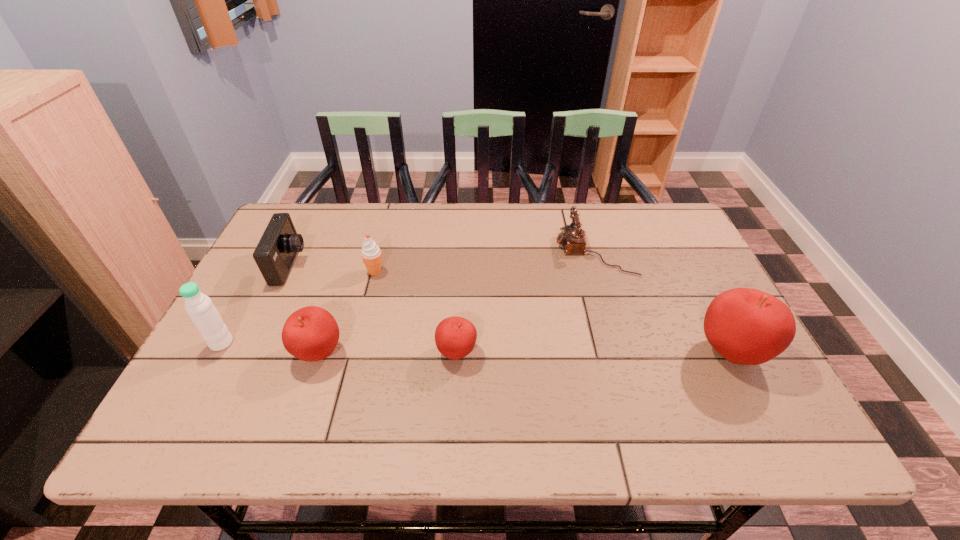
Locate an element on the screen. vacant position located 0.300m on the left of the shortest apple is located at coordinates (307, 353).

Where is `vacant space located on the left of the rightmost object`? The image size is (960, 540). vacant space located on the left of the rightmost object is located at coordinates (535, 352).

Where is `vacant point located on the dial of the telephone`? vacant point located on the dial of the telephone is located at coordinates (495, 252).

This screenshot has width=960, height=540. In order to click on vacant space located on the dial of the telephone in this screenshot , I will do `click(498, 252)`.

Locate an element on the screen. The image size is (960, 540). free space located on the dial of the telephone is located at coordinates (505, 252).

Locate an element on the screen. The image size is (960, 540). free point located 0.380m on the right of the icecream is located at coordinates (521, 272).

The width and height of the screenshot is (960, 540). In order to click on vacant region located on the front-facing side of the second object from left to right in this screenshot , I will do `click(354, 266)`.

Locate an element on the screen. The image size is (960, 540). blank space located on the back of the leftmost object is located at coordinates (270, 254).

The height and width of the screenshot is (540, 960). Find the location of `telephone present at the far edge`. telephone present at the far edge is located at coordinates (572, 239).

In order to click on camera that is positioned at the far edge in this screenshot , I will do `click(275, 253)`.